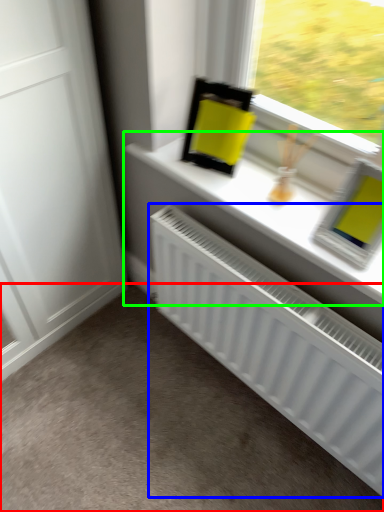
Question: Which object is positioned closest to plain (highlighted by a red box)? Select from radiator (highlighted by a blue box) and window sill (highlighted by a green box).

Choices:
 (A) radiator
 (B) window sill

Answer: (A)